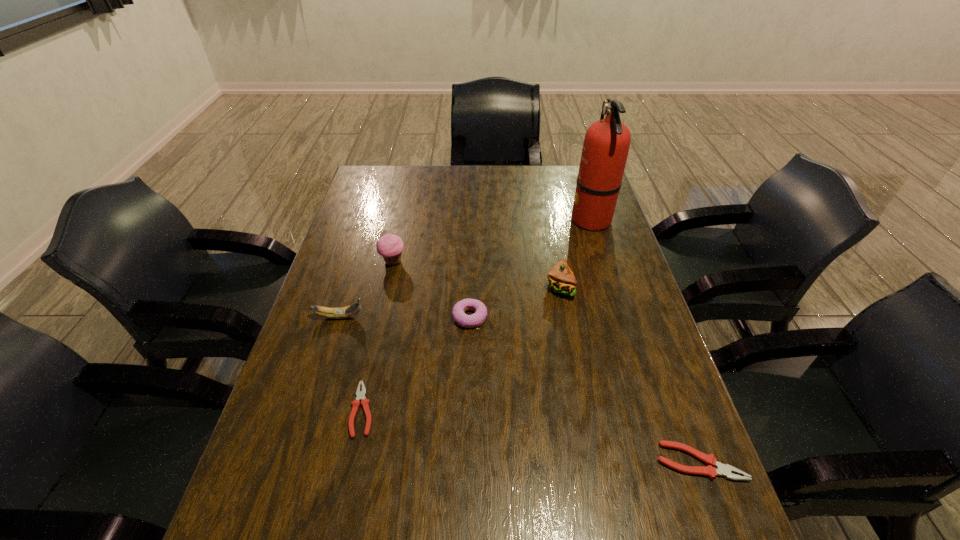
To achieve uniform spacing by inserting another pliers among them, please point to a free space for this new pliers. Please provide its 2D coordinates. Your answer should be formatted as a tuple, i.e. [(x, y)], where the tuple contains the x and y coordinates of a point satisfying the conditions above.

[(523, 434)]